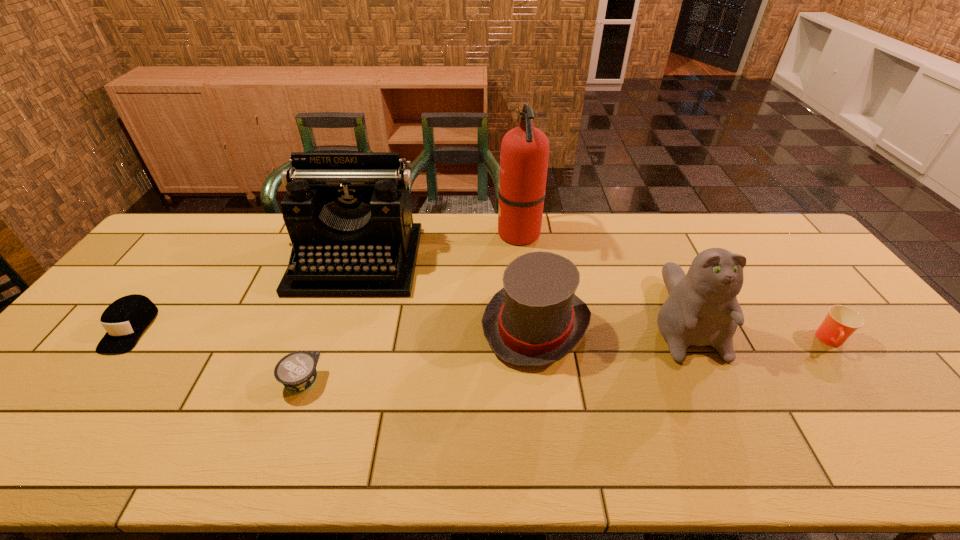
The image size is (960, 540). I want to click on free space at the far edge of the desktop, so click(600, 239).

This screenshot has width=960, height=540. I want to click on vacant space at the near edge of the desktop, so click(348, 447).

This screenshot has height=540, width=960. Find the location of `free space at the left edge of the desktop`. free space at the left edge of the desktop is located at coordinates coord(178,269).

The image size is (960, 540). What are the coordinates of `free spot at the right edge of the desktop` in the screenshot? It's located at (778, 262).

Where is `free spot at the far left corner of the desktop`? The height and width of the screenshot is (540, 960). free spot at the far left corner of the desktop is located at coordinates (180, 219).

This screenshot has height=540, width=960. I want to click on vacant space that's between the rightmost object and the leftmost object, so click(x=481, y=334).

You are a GUI agent. You are given a task and a screenshot of the screen. Output one action in this format:
    pyautogui.click(x=<x>, y=<y>)
    Task: Click on the free space between the typewriter and the cap
    
    Given the screenshot: What is the action you would take?
    pyautogui.click(x=244, y=294)

At what (x,y) coordinates should I click in order to perform the action: click on vacant region between the sixth object from left to right and the cap. Please return your answer as a coordinate pair (x, y). This screenshot has width=960, height=540. Looking at the image, I should click on (406, 322).

Image resolution: width=960 pixels, height=540 pixels. In order to click on vacant space in between the tallest object and the shortest object in this screenshot , I will do `click(410, 307)`.

I want to click on vacant point located between the rightmost object and the yogurt, so click(566, 361).